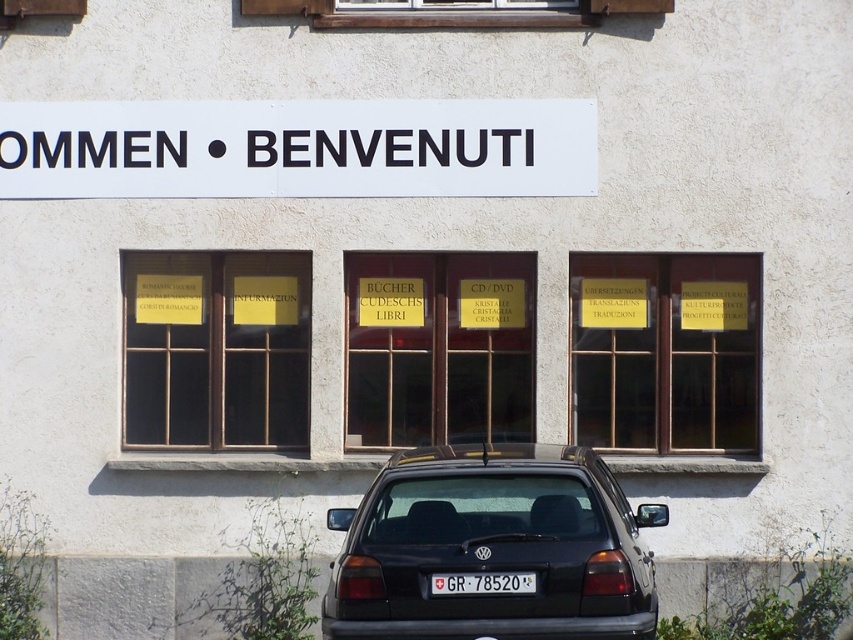
Does black matte sedan at center have a lesser width compared to white plastic license plate at center?

No.

Between point (368, 632) and point (511, 572), which one is positioned in front?

Point (511, 572)

Identify the location of black matte sedan at center. The width and height of the screenshot is (853, 640). [x=492, y=547].

Between point (289, 177) and point (450, 586), which one is positioned behind?

The point (289, 177) is behind.

Find the location of a particular element. white plastic sign at upper center is located at coordinates (299, 148).

From the picture: Who is higher up, black matte sedan at center or white plastic sign at upper center?

Positioned higher is white plastic sign at upper center.

How distant is black matte sedan at center from white plastic sign at upper center?

black matte sedan at center and white plastic sign at upper center are 3.28 meters apart.

At what (x,y) coordinates should I click in order to perform the action: click on black matte sedan at center. Please return your answer as a coordinate pair (x, y). Looking at the image, I should click on (492, 547).

This screenshot has width=853, height=640. I want to click on black matte sedan at center, so click(x=492, y=547).